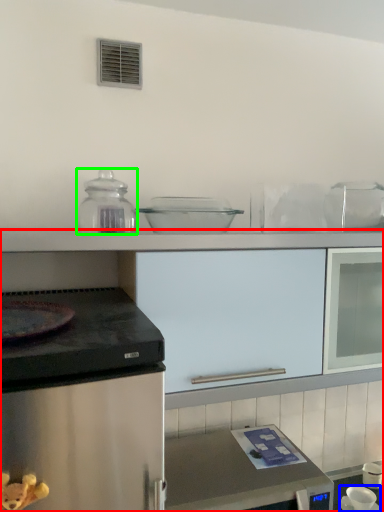
Question: Which is nearer to the cabinetry (highlighted by a red box)? appliance (highlighted by a blue box) or kitchen appliance (highlighted by a green box).

Choices:
 (A) appliance
 (B) kitchen appliance

Answer: (B)